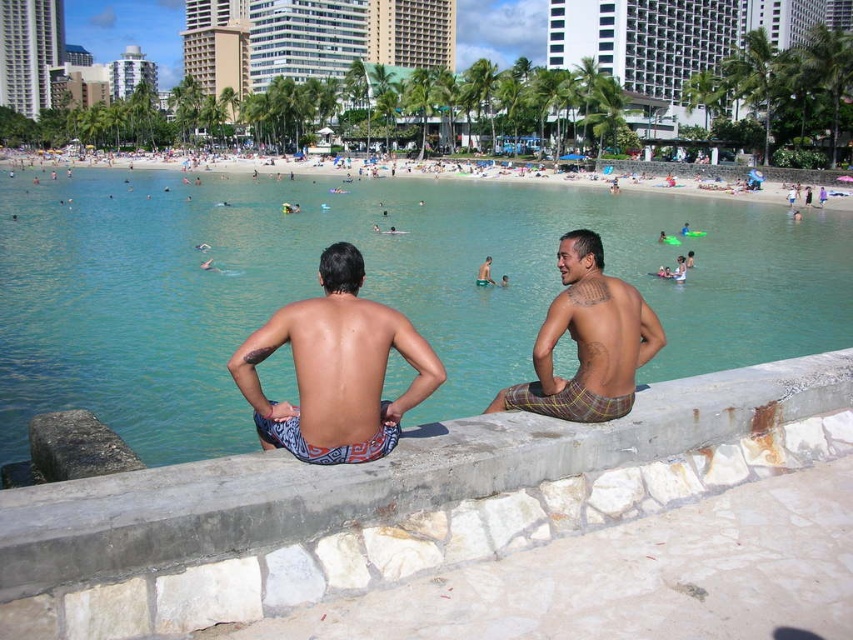
Question: Does clear blue water at center lie behind concrete at center?

Choices:
 (A) yes
 (B) no

Answer: (A)

Question: Does concrete at center appear under smooth tan skin at center?

Choices:
 (A) no
 (B) yes

Answer: (B)

Question: Considering the real-world distances, which object is closest to the concrete at center?

Choices:
 (A) blue patterned shorts at center
 (B) brown plaid shorts at center

Answer: (A)

Question: Can you confirm if concrete at center is thinner than blue patterned shorts at center?

Choices:
 (A) yes
 (B) no

Answer: (B)

Question: Which object appears farthest from the camera in this image?

Choices:
 (A) blue patterned shorts at center
 (B) smooth tan skin at center
 (C) concrete at center
 (D) clear blue water at center

Answer: (B)

Question: Which object is farther from the camera taking this photo?

Choices:
 (A) blue patterned shorts at center
 (B) brown plaid shorts at center

Answer: (B)